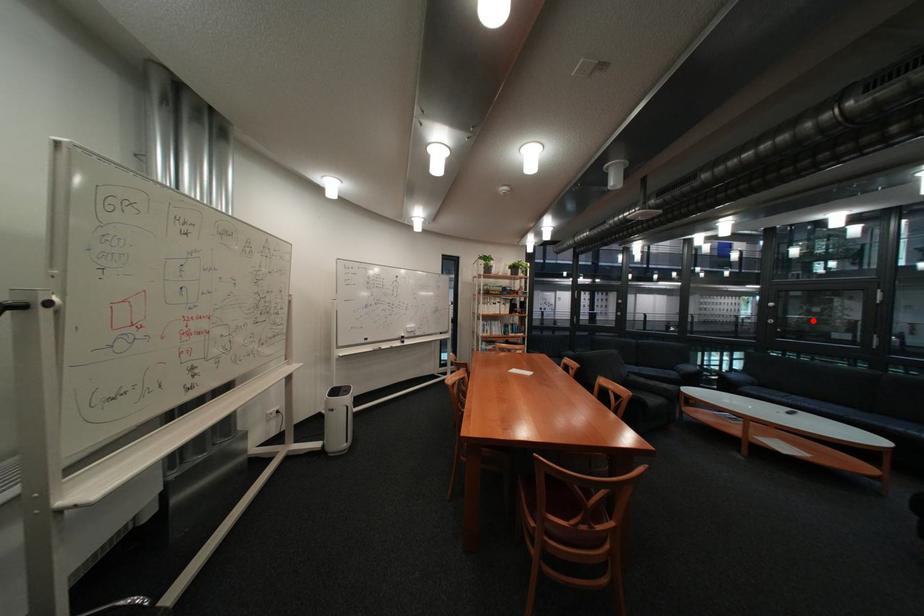
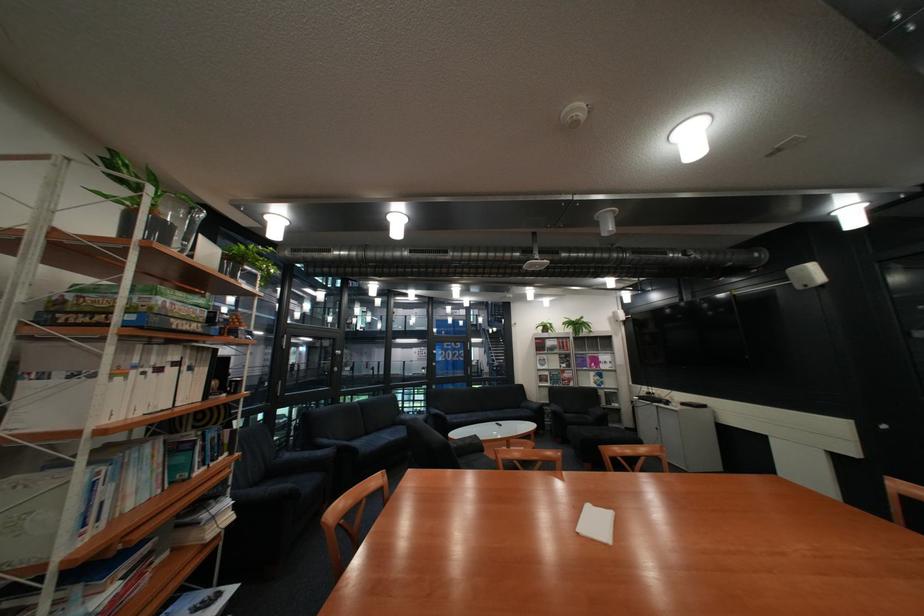
The point at the highlighted location is marked in the first image. Where is the corresponding point in the second image?

(344, 365)